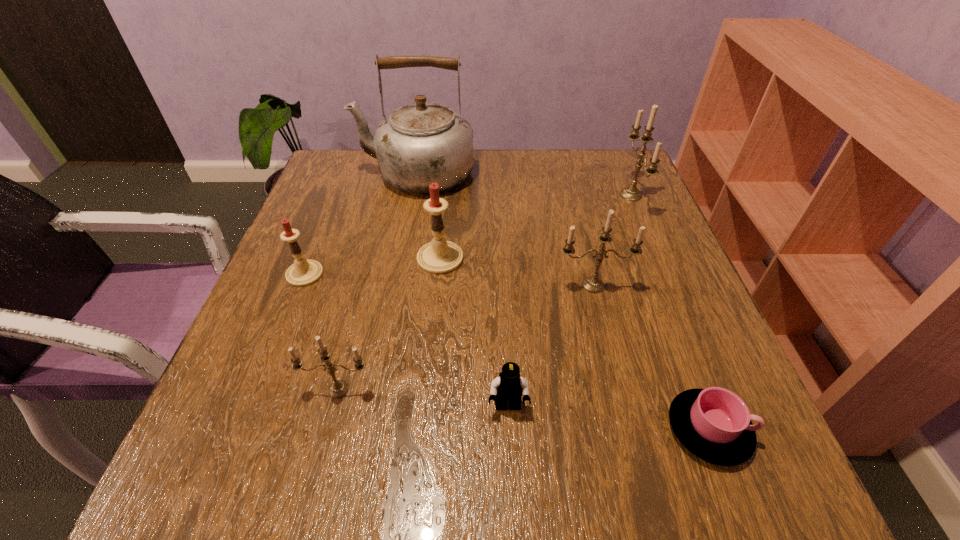
Locate an element on the screen. vacant space at the near edge of the desktop is located at coordinates (325, 461).

The image size is (960, 540). Identify the location of vacant region at the left edge of the desktop. (311, 244).

Identify the location of vacant area at the right edge. Image resolution: width=960 pixels, height=540 pixels. (600, 224).

Identify the location of vacant position at the far right corner of the desktop. (606, 190).

Find the location of `free space between the shortest object and the right red candle`. free space between the shortest object and the right red candle is located at coordinates (574, 344).

At what (x,y) coordinates should I click in order to perform the action: click on vacant region between the left red candle and the leftmost metallic candle. Please return your answer as a coordinate pair (x, y). The width and height of the screenshot is (960, 540). Looking at the image, I should click on (322, 332).

The image size is (960, 540). I want to click on vacant point located between the black Lego and the smaller red candle, so click(x=406, y=340).

Where is `vacant area that lies between the leftmost candle and the leftmost metallic candle`? This screenshot has height=540, width=960. vacant area that lies between the leftmost candle and the leftmost metallic candle is located at coordinates (322, 332).

At what (x,y) coordinates should I click in order to perform the action: click on blank region between the kettle and the leftmost metallic candle. Please return your answer as a coordinate pair (x, y). Image resolution: width=960 pixels, height=540 pixels. Looking at the image, I should click on (377, 281).

Locate an element on the screen. Image resolution: width=960 pixels, height=540 pixels. free space between the fourth object from right to left and the kettle is located at coordinates (462, 291).